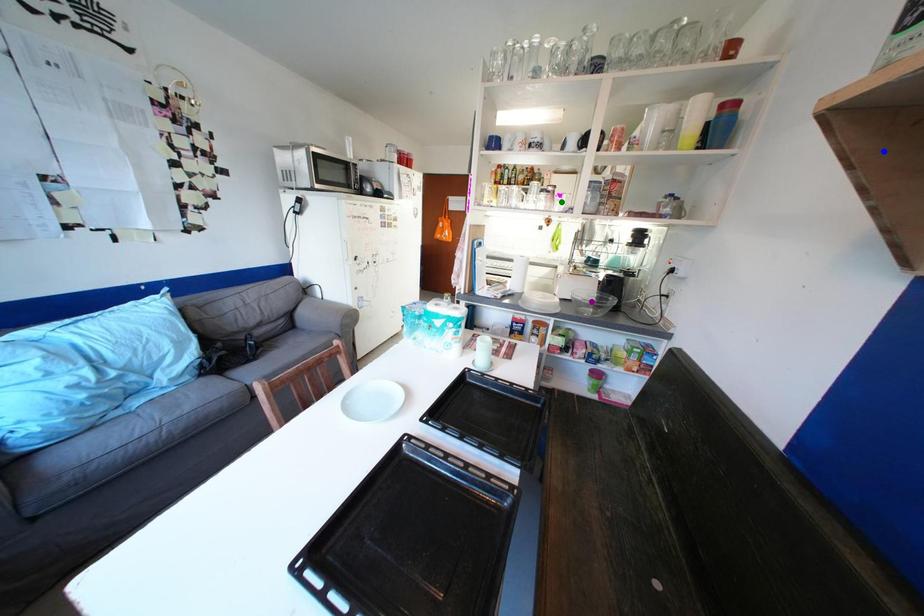
Order these from nearest to farthest:
1. blue point
2. green point
3. purple point

blue point < purple point < green point